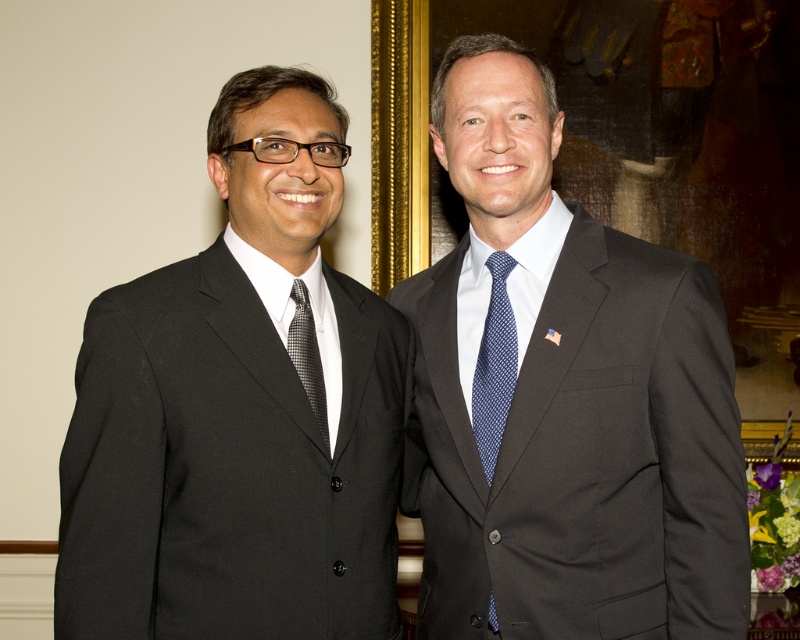
Who is positioned more to the left, blue dotted tie at center or black textured tie at left?

A: From the viewer's perspective, black textured tie at left appears more on the left side.

Looking at this image, does blue dotted tie at center have a lesser width compared to black textured tie at left?

No.

Is point (480, 374) positioned in front of point (292, 342)?

No.

The image size is (800, 640). In order to click on blue dotted tie at center in this screenshot , I will do `click(494, 364)`.

Can you confirm if black matte suit at left is positioned below blue dotted tie at center?

No.

Which of these two, black matte suit at left or blue dotted tie at center, stands shorter?

blue dotted tie at center is shorter.

Describe the element at coordinates (238, 412) in the screenshot. I see `black matte suit at left` at that location.

Identify the location of black matte suit at left. This screenshot has width=800, height=640. click(x=238, y=412).

How distant is black matte suit at left from black textured tie at left?

black matte suit at left and black textured tie at left are 8.03 inches apart.

Does black matte suit at left have a greater height compared to black textured tie at left?

Correct, black matte suit at left is much taller as black textured tie at left.

Who is more distant from viewer, (292, 616) or (308, 339)?

The point (308, 339) is more distant.

The image size is (800, 640). In order to click on black matte suit at left in this screenshot , I will do `click(238, 412)`.